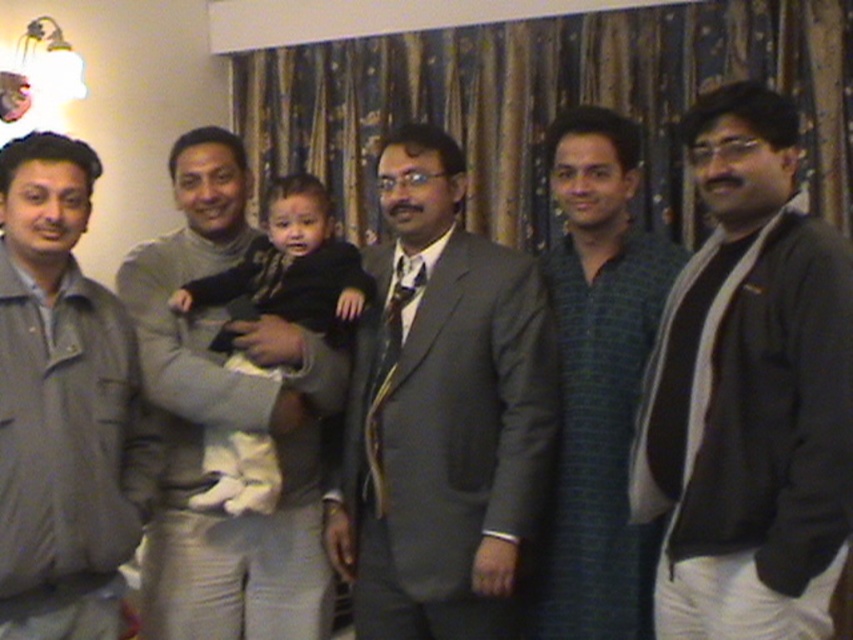
Does gray fabric jacket at left appear under green striped shirt at center?

Yes, gray fabric jacket at left is below green striped shirt at center.

What do you see at coordinates (62, 406) in the screenshot?
I see `gray fabric jacket at left` at bounding box center [62, 406].

Does point (59, 474) lie behind point (579, 358)?

No, it is not.

You are a GUI agent. You are given a task and a screenshot of the screen. Output one action in this format:
    pyautogui.click(x=<x>, y=<y>)
    Task: Click on the gray fabric jacket at left
    Image resolution: width=853 pixels, height=640 pixels.
    Given the screenshot: What is the action you would take?
    pyautogui.click(x=62, y=406)

Does dark gray sweater at right appear over matte gray suit at center?

Correct, dark gray sweater at right is located above matte gray suit at center.

The image size is (853, 640). What do you see at coordinates (749, 394) in the screenshot?
I see `dark gray sweater at right` at bounding box center [749, 394].

Find the location of a particular element. Image resolution: width=853 pixels, height=640 pixels. dark gray sweater at right is located at coordinates (749, 394).

Who is more forward, (648, 502) or (262, 253)?

Positioned in front is point (648, 502).

Can you confirm if dark gray sweater at right is bigger than soft white fabric baby at center?

Correct, dark gray sweater at right is larger in size than soft white fabric baby at center.

Between point (763, 579) and point (270, 209), which one is positioned in front?

Positioned in front is point (763, 579).

Find the location of a particular element. The width and height of the screenshot is (853, 640). dark gray sweater at right is located at coordinates (749, 394).